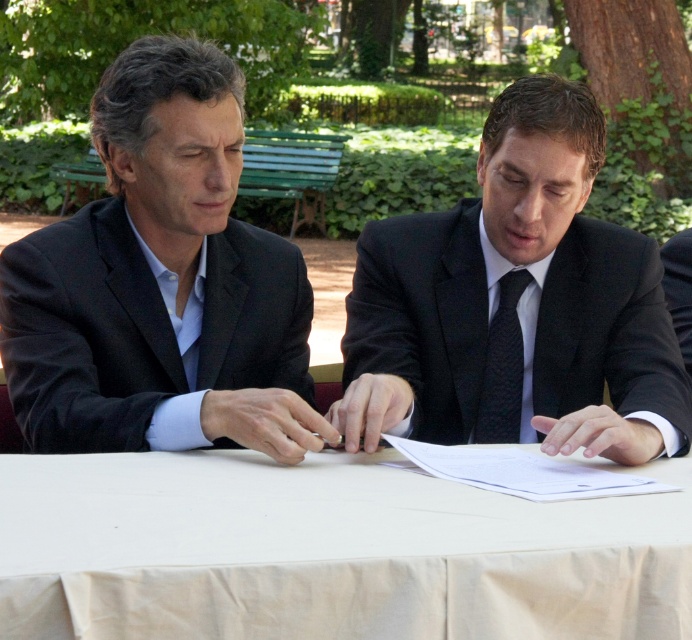
Question: Which object is the farthest from the white cloth at center?

Choices:
 (A) black matte suit at left
 (B) white paper at center

Answer: (A)

Question: Is white paper at center further to camera compared to black textured tie at center?

Choices:
 (A) yes
 (B) no

Answer: (B)

Question: From the image, what is the correct spatial relationship of white cloth at center in relation to black matte suit at left?

Choices:
 (A) left
 (B) right

Answer: (B)

Question: Observing the image, what is the correct spatial positioning of black matte suit at center in reference to black silk suit at lower right?

Choices:
 (A) below
 (B) above

Answer: (A)

Question: Estimate the real-world distances between objects in this image. Which object is closer to the black matte suit at center?

Choices:
 (A) white cloth at center
 (B) black silk suit at lower right
 (C) black matte suit at left
 (D) white paper at center

Answer: (D)

Question: Which of these objects is positioned farthest from the black matte suit at center?

Choices:
 (A) black matte suit at left
 (B) black silk suit at lower right
 (C) white cloth at center
 (D) black textured tie at center

Answer: (B)